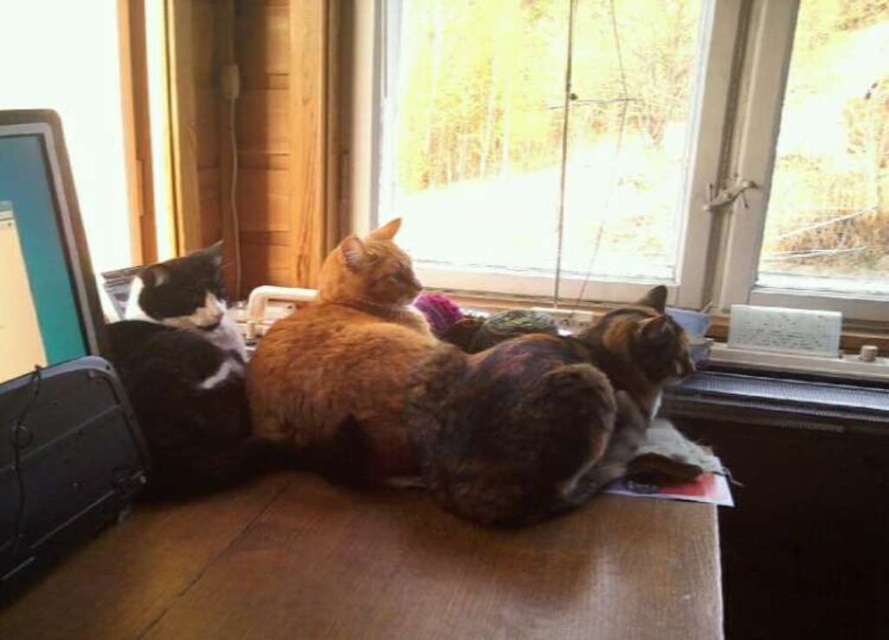
You are setting up a workstation and want to place a keyboard between the multicolored fur cat at center and the matte black monitor at left. Can you fit the keyboard there if it requires at least 25 inches of space?

The distance between the multicolored fur cat at center and the matte black monitor at left is 25.19 inches, which is just over the required 25 inches. Therefore, the keyboard can fit between them.

You are trying to locate the multicolored fur cat at center in the image. Given that the coordinate system starts at the bottom left corner of the image with x increasing to the right and y increasing upwards, can you determine if the cat is positioned closer to the bottom or the top of the image?

The multicolored fur cat at center is located at point (543, 412). Since the y coordinate is 0.612, which is more than halfway up the image, the cat is closer to the top of the image.

You are organizing a space for a cat and a monitor. You have a small shelf that can hold items up to 30 cm in height. The multicolored fur cat at center and the matte black monitor at left are both candidates for placement. Based on their sizes, which item would you choose to place on the shelf to ensure it fits?

The matte black monitor at left should be placed on the shelf since it is smaller in size compared to the multicolored fur cat at center, ensuring it fits within the 30 cm height limit.